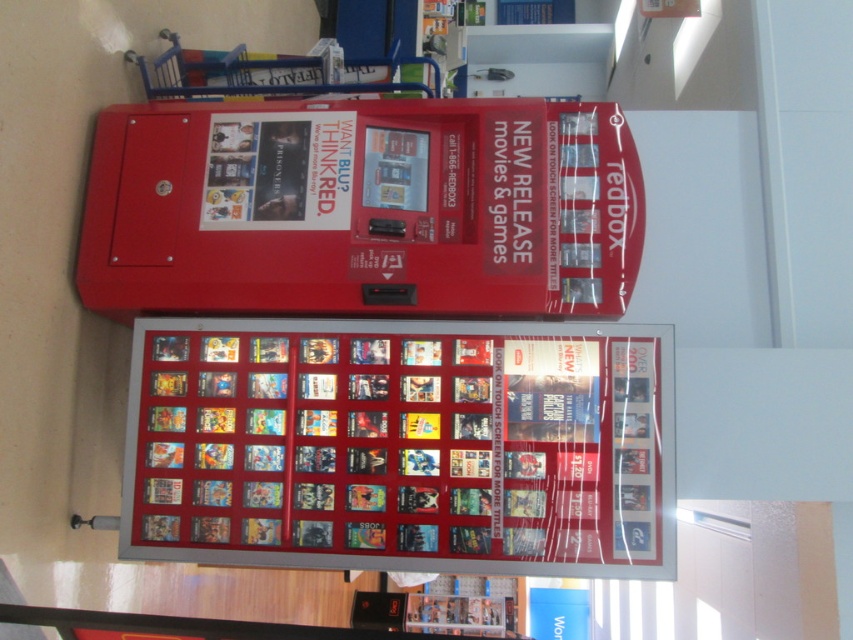
Question: Which point is farther from the camera taking this photo?

Choices:
 (A) (485, 452)
 (B) (231, 273)

Answer: (B)

Question: Which point is closer to the camera?

Choices:
 (A) metallic silver frame at center
 (B) metallic red vending machine at center

Answer: (A)

Question: Is metallic silver frame at center to the right of metallic red vending machine at center from the viewer's perspective?

Choices:
 (A) no
 (B) yes

Answer: (B)

Question: Which object is closer to the camera taking this photo?

Choices:
 (A) metallic silver frame at center
 (B) metallic red vending machine at center

Answer: (A)

Question: Is metallic silver frame at center in front of metallic red vending machine at center?

Choices:
 (A) no
 (B) yes

Answer: (B)

Question: Is metallic silver frame at center in front of metallic red vending machine at center?

Choices:
 (A) yes
 (B) no

Answer: (A)